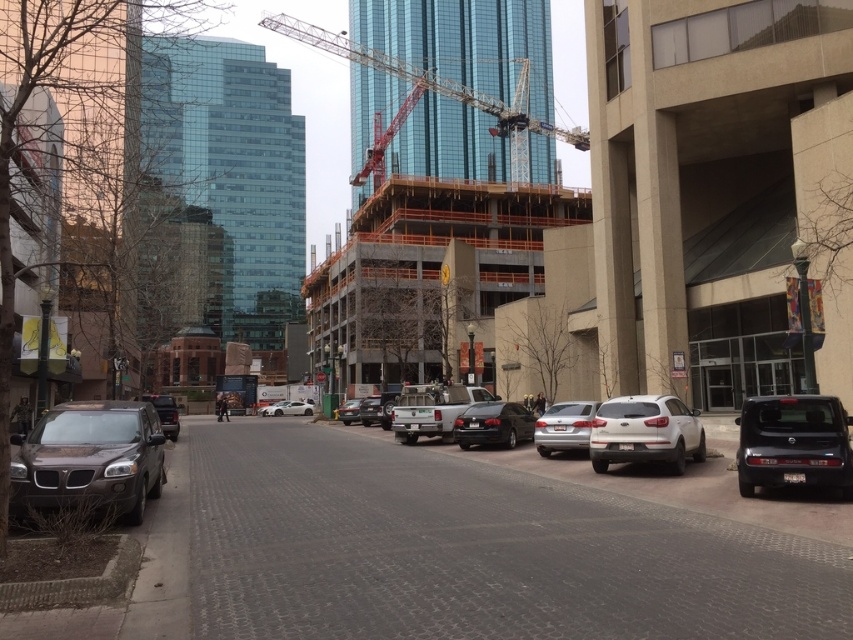
You are standing at the center of the street and want to find the satin silver sedan at center. Based on its 2D coordinates, in which direction should you look relative to your position?

The satin silver sedan at center is located at coordinates 0.667 on the x and y axes. Since you are at the center of the street, which would be the origin point, you should look towards the northeast direction to find the satin silver sedan at center.

You are a delivery person needing to park your van, which is 22 feet long, in the parking spot where the shiny black sedan at center is currently parked. Can your van fit in that spot?

The shiny black sedan at center is parked in a spot that is 73.44 feet long. Since your van is only 22 feet long, it will fit comfortably within the space.

You need to park a new car that is 2 meters wide in the urban street scene. Looking at the white matte truck at center and the shiny black sedan at center, which vehicle has enough space between them to accommodate your car?

The white matte truck at center is wider than the shiny black sedan at center. Therefore, the space between them may be sufficient for a 2 meter wide car, but this depends on the exact positioning and spacing between the two vehicles.